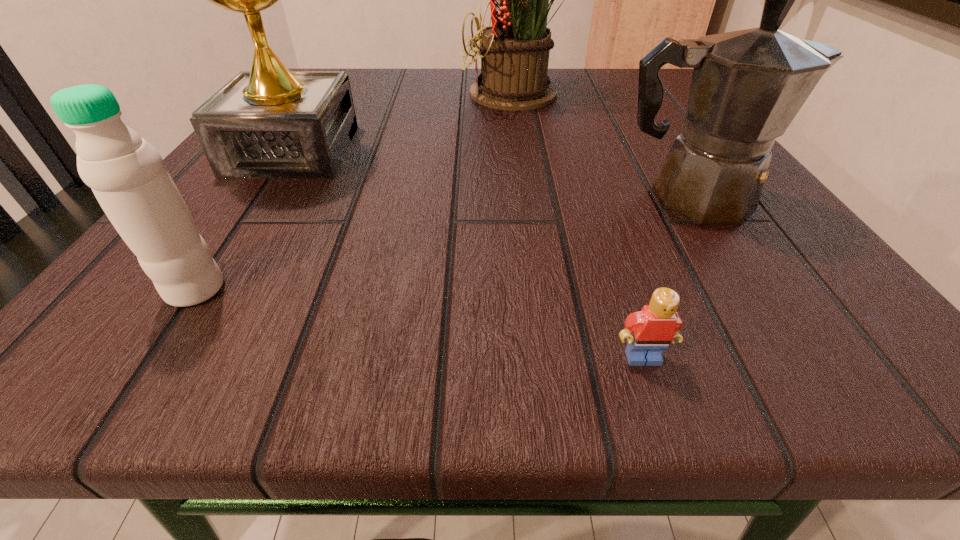
Identify the location of unoccupied area between the award and the coffeepot. (492, 174).

Where is `empty space between the shortest object and the fourth tallest object`? This screenshot has height=540, width=960. empty space between the shortest object and the fourth tallest object is located at coordinates (419, 323).

Where is `vacant space that's between the coffeepot and the fourth farthest object`? Image resolution: width=960 pixels, height=540 pixels. vacant space that's between the coffeepot and the fourth farthest object is located at coordinates (444, 244).

Where is `free space between the coffeepot and the flower arrangement`? The width and height of the screenshot is (960, 540). free space between the coffeepot and the flower arrangement is located at coordinates (607, 146).

Identify which object is the third nearest to the coffeepot. Please provide its 2D coordinates. Your answer should be formatted as a tuple, i.e. [(x, y)], where the tuple contains the x and y coordinates of a point satisfying the conditions above.

[(269, 122)]

You are a GUI agent. You are given a task and a screenshot of the screen. Output one action in this format:
    pyautogui.click(x=<x>, y=<y>)
    Task: Click on the object that ranks as the second closest to the farthest object
    Image resolution: width=960 pixels, height=540 pixels.
    Given the screenshot: What is the action you would take?
    pyautogui.click(x=747, y=86)

Identify the location of vacant space that satisfies the following two spatial constraints: 1. in front of the farthest object with the fan visible; 2. on the front-facing side of the fourth shortest object. This screenshot has height=540, width=960. (535, 150).